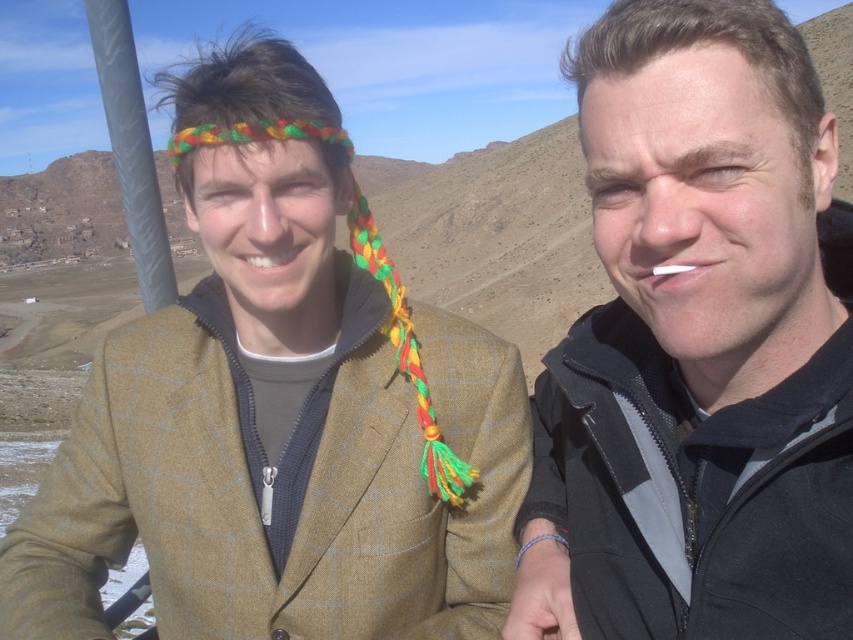
Question: Is matte black jacket at right above metallic gray pole at left?

Choices:
 (A) yes
 (B) no

Answer: (B)

Question: Which point appears farthest from the camera in this image?

Choices:
 (A) (389, 321)
 (B) (759, 548)

Answer: (A)

Question: Does matte black jacket at right have a smaller size compared to metallic gray pole at left?

Choices:
 (A) yes
 (B) no

Answer: (A)

Question: Which point is farther from the camera taking this photo?

Choices:
 (A) (625, 433)
 (B) (264, 122)
 (C) (144, 269)

Answer: (C)

Question: Which point is closer to the camera?

Choices:
 (A) (97, 16)
 (B) (212, 138)

Answer: (B)

Question: Where is metallic gray pole at left located in relation to multicolored braided headscarf at left in the image?

Choices:
 (A) left
 (B) right

Answer: (A)